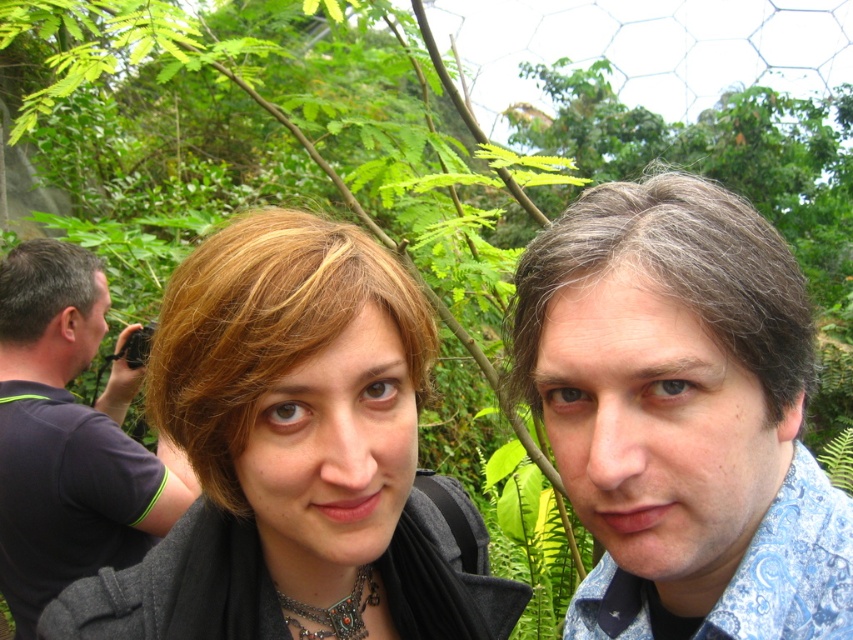
Question: Is matte black jacket at center to the left of dark blue t-shirt at left from the viewer's perspective?

Choices:
 (A) no
 (B) yes

Answer: (A)

Question: Which point is closer to the camera?

Choices:
 (A) dark blue t-shirt at left
 (B) blue paisley shirt at right

Answer: (B)

Question: Is blue paisley shirt at right bigger than dark blue t-shirt at left?

Choices:
 (A) yes
 (B) no

Answer: (B)

Question: Which point is closer to the camera?

Choices:
 (A) blue paisley shirt at right
 (B) matte black jacket at center

Answer: (A)

Question: Can you confirm if matte black jacket at center is thinner than dark blue t-shirt at left?

Choices:
 (A) yes
 (B) no

Answer: (B)

Question: Which of the following is the farthest from the observer?

Choices:
 (A) [x=276, y=532]
 (B) [x=604, y=232]
 (C) [x=59, y=292]

Answer: (C)